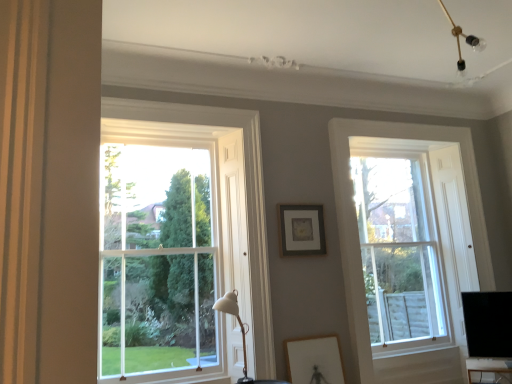
Question: Choose the correct answer: Is clear glass window at left, which appears as the 2th window when viewed from the right, inside white matte table lamp at center or outside it?

Choices:
 (A) outside
 (B) inside

Answer: (A)

Question: In terms of width, does clear glass window at left, which appears as the 2th window when viewed from the right, look wider or thinner when compared to white matte table lamp at center?

Choices:
 (A) thin
 (B) wide

Answer: (A)

Question: Which object is the farthest from the matte black picture frame at center, marked as the second picture frame in a front-to-back arrangement?

Choices:
 (A) black glossy monitor at lower right
 (B) clear glass window at left, which appears as the first window when viewed from the left
 (C) clear glass window at right, the 1th window in the right-to-left sequence
 (D) wooden framed picture at lower center, the 2th picture frame when ordered from back to front
 (E) white matte table lamp at center

Answer: (A)

Question: Which is farther from the matte black picture frame at center, which is the second picture frame in bottom-to-top order?

Choices:
 (A) black glossy monitor at lower right
 (B) white matte table lamp at center
 (C) clear glass window at right, which is the 2th window in front-to-back order
 (D) clear glass window at left, positioned as the 2th window in back-to-front order
 (E) wooden framed picture at lower center, arranged as the 1th picture frame when ordered from the bottom

Answer: (A)